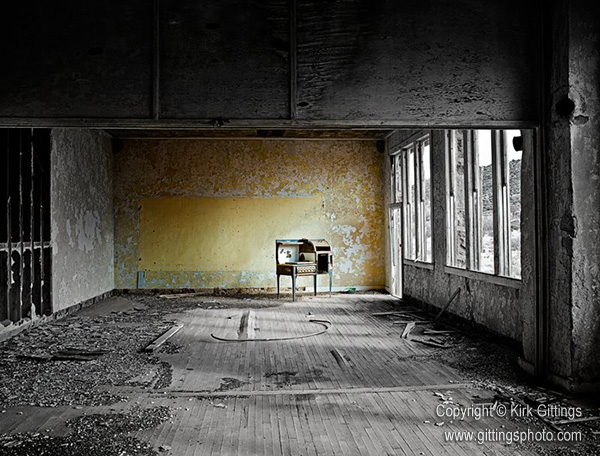
Where is `windows`? windows is located at coordinates (510, 181), (482, 175), (462, 187), (430, 182), (405, 177), (397, 173).